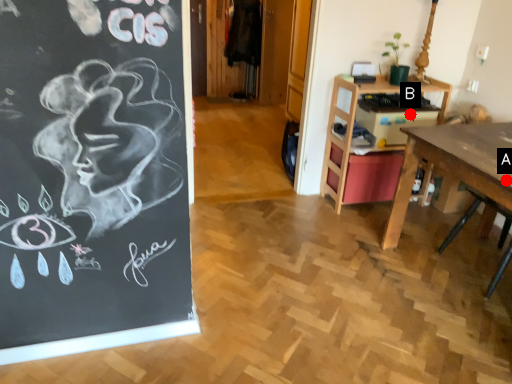
Question: Two points are circled on the image, labeled by A and B beside each circle. Which point appears farthest from the camera in this image?

Choices:
 (A) A is further
 (B) B is further

Answer: (B)